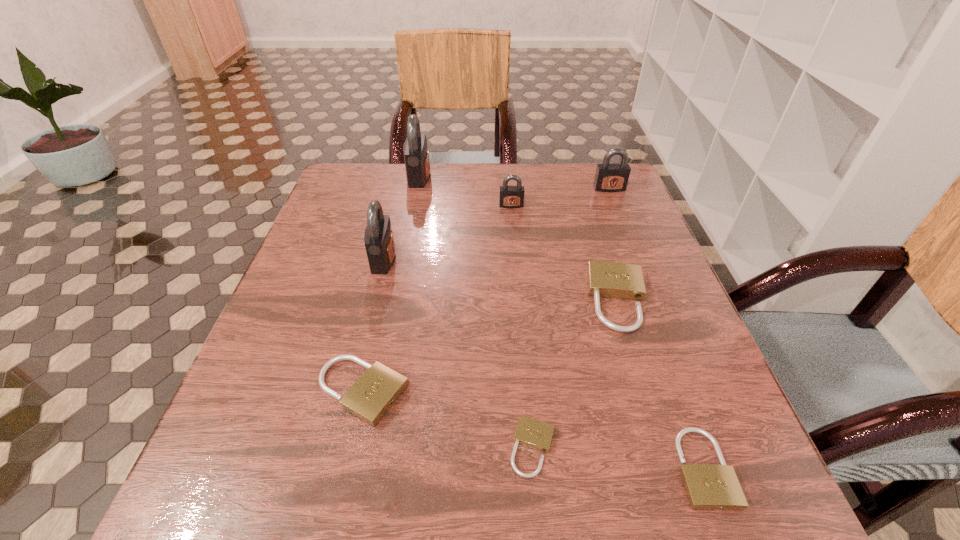
Identify which object is the fifth closest to the second biggest beige padlock. Please provide its 2D coordinates. Your answer should be formatted as a tuple, i.e. [(x, y)], where the tuple contains the x and y coordinates of a point satisfying the conditions above.

[(509, 196)]

You are a GUI agent. You are given a task and a screenshot of the screen. Output one action in this format:
    pyautogui.click(x=<x>, y=<y>)
    Task: Click on the object that is the fifth closest to the nearest gray padlock
    The height and width of the screenshot is (540, 960).
    Given the screenshot: What is the action you would take?
    pyautogui.click(x=532, y=433)

This screenshot has height=540, width=960. In order to click on padlock that can be found as the seventh closest to the farthest beige padlock in this screenshot , I will do `click(416, 153)`.

Locate which padlock is the fifth closest to the tallest padlock. Please provide its 2D coordinates. Your answer should be formatted as a tuple, i.e. [(x, y)], where the tuple contains the x and y coordinates of a point satisfying the conditions above.

[(374, 393)]

Select which gray padlock is the third closest to the second smallest beige padlock. Please provide its 2D coordinates. Your answer should be formatted as a tuple, i.e. [(x, y)], where the tuple contains the x and y coordinates of a point satisfying the conditions above.

[(610, 177)]

In order to click on gray padlock that is the third nearest to the biggest gray padlock in this screenshot , I will do `click(610, 177)`.

Find the location of a particular element. This screenshot has width=960, height=540. the third closest beige padlock relative to the farthest beige padlock is located at coordinates (374, 393).

Select which beige padlock appears as the third closest to the second biggest beige padlock. Please provide its 2D coordinates. Your answer should be formatted as a tuple, i.e. [(x, y)], where the tuple contains the x and y coordinates of a point satisfying the conditions above.

[(708, 486)]

Identify the location of free point that satisfies the following two spatial constraints: 1. on the front of the second biggest gray padlock near the keyhole; 2. on the right side of the shortest object. (337, 448).

At what (x,y) coordinates should I click in order to perform the action: click on vacant region that satisfies the following two spatial constraints: 1. on the front of the sixth nearest padlock near the keyhole; 2. on the right side of the second shortest object. Please return your answer as a coordinate pair (x, y). The width and height of the screenshot is (960, 540). Looking at the image, I should click on (535, 468).